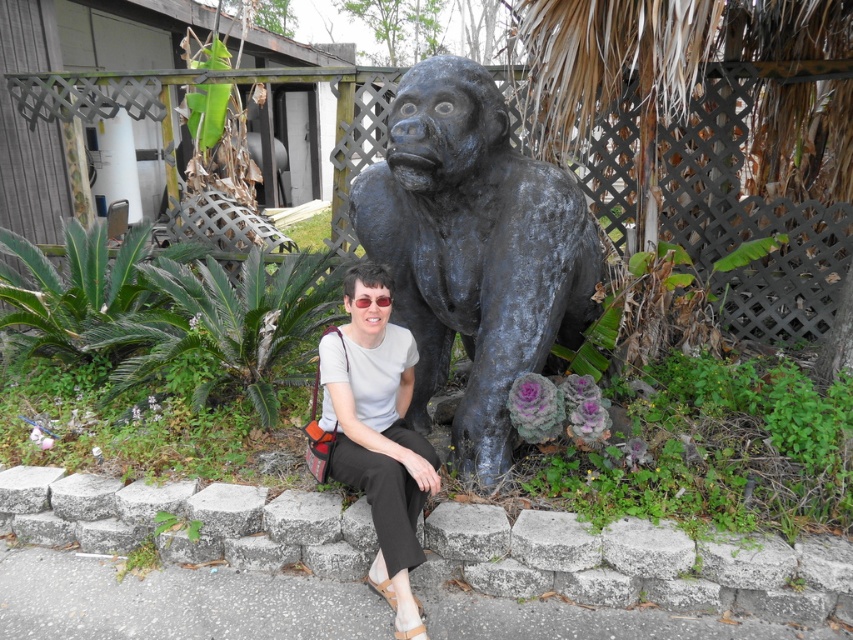
Is matte white shirt at center taller than clear plastic goggles at center?

Indeed, matte white shirt at center has a greater height compared to clear plastic goggles at center.

Who is higher up, matte white shirt at center or clear plastic goggles at center?

clear plastic goggles at center is above.

Between point (343, 394) and point (374, 300), which one is positioned in front?

Point (343, 394)

The image size is (853, 640). I want to click on matte white shirt at center, so click(378, 435).

Which is more to the right, gray concrete curb at lower center or clear plastic goggles at center?

From the viewer's perspective, gray concrete curb at lower center appears more on the right side.

Is gray concrete curb at lower center wider than clear plastic goggles at center?

Correct, the width of gray concrete curb at lower center exceeds that of clear plastic goggles at center.

Which is in front, point (68, 490) or point (354, 300)?

Point (354, 300)

This screenshot has width=853, height=640. In order to click on gray concrete curb at lower center in this screenshot , I will do `click(636, 563)`.

Is shiny black statue at center behind matte white shirt at center?

Yes, it is.

Does shiny black statue at center appear over matte white shirt at center?

Correct, shiny black statue at center is located above matte white shirt at center.

Between point (437, 65) and point (393, 397), which one is positioned behind?

Point (393, 397)

Where is `shiny black statue at center`? This screenshot has height=640, width=853. shiny black statue at center is located at coordinates (474, 250).